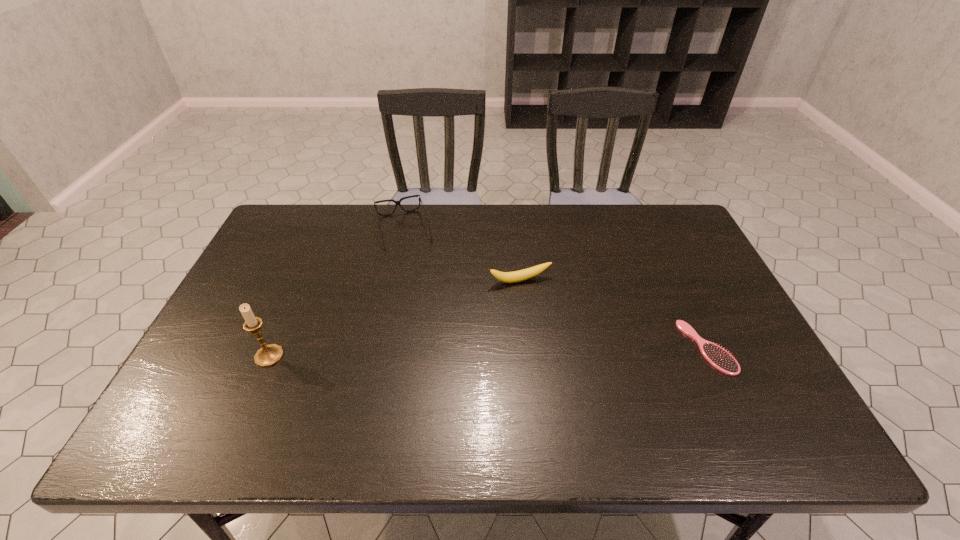
Find the location of a particular element. The width and height of the screenshot is (960, 540). object at the near right corner is located at coordinates (718, 357).

This screenshot has width=960, height=540. Find the location of `vacant space at the far edge`. vacant space at the far edge is located at coordinates (634, 224).

Find the location of a particular element. The width and height of the screenshot is (960, 540). vacant area at the near edge of the desktop is located at coordinates [x=433, y=383].

Identify the location of vacant space at the left edge of the desktop. The width and height of the screenshot is (960, 540). (272, 266).

Locate an element on the screen. vacant space at the right edge of the desktop is located at coordinates click(x=704, y=305).

Find the location of a particular element. vacant position at the far left corner of the desktop is located at coordinates (278, 221).

The width and height of the screenshot is (960, 540). In the image, there is a desktop. What are the coordinates of `free space at the far right corner` in the screenshot? It's located at (683, 225).

The image size is (960, 540). I want to click on unoccupied position between the third object from right to left and the banana, so click(462, 255).

At what (x,y) coordinates should I click in order to perform the action: click on vacant area that lies between the leftmost object and the third object from right to left. Please return your answer as a coordinate pair (x, y). The height and width of the screenshot is (540, 960). Looking at the image, I should click on (336, 293).

This screenshot has height=540, width=960. I want to click on free spot between the hairbrush and the second object from right to left, so click(x=613, y=314).